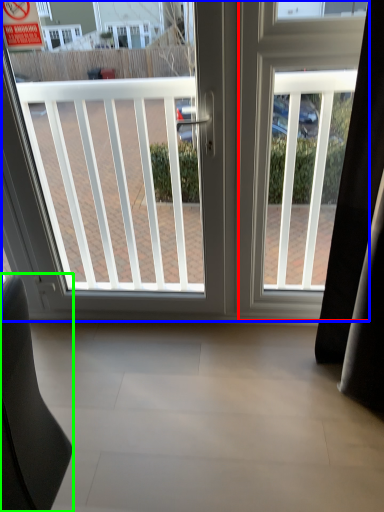
Question: Based on their relative distances, which object is nearer to screen door (highlighted by a red box)? Choose from window (highlighted by a blue box) and furniture (highlighted by a green box).

Choices:
 (A) window
 (B) furniture

Answer: (A)